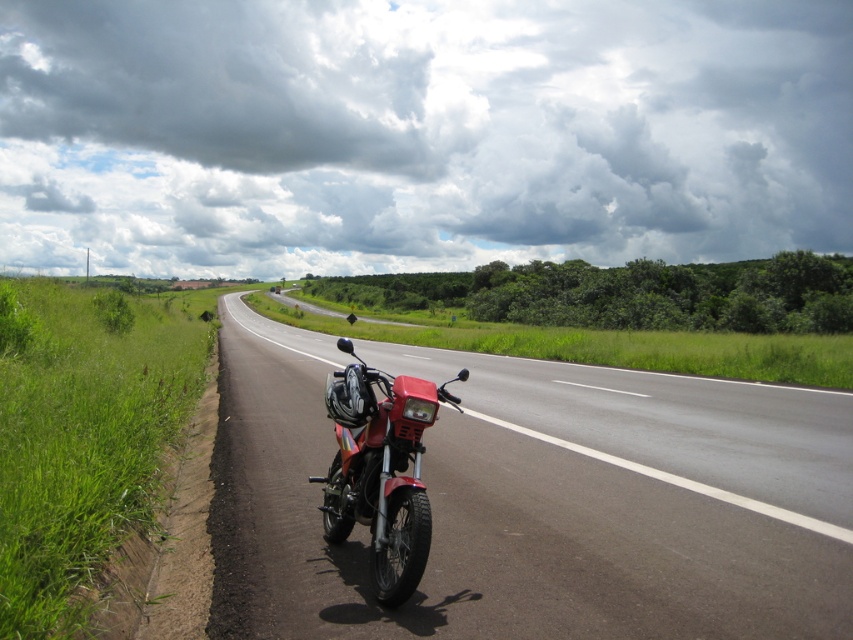
Does smooth asphalt highway at center appear over green grass at left?

Incorrect, smooth asphalt highway at center is not positioned above green grass at left.

Is point (570, 397) in front of point (32, 636)?

No, it is not.

This screenshot has height=640, width=853. Identify the location of smooth asphalt highway at center. (538, 500).

Who is taller, smooth asphalt highway at center or metallic red motorcycle at center?

metallic red motorcycle at center is taller.

The width and height of the screenshot is (853, 640). What do you see at coordinates (538, 500) in the screenshot?
I see `smooth asphalt highway at center` at bounding box center [538, 500].

Measure the distance between point (544, 557) and camera.

Point (544, 557) and camera are 5.08 meters apart.

Find the location of a particular element. The height and width of the screenshot is (640, 853). smooth asphalt highway at center is located at coordinates (538, 500).

Who is shorter, green grass at left or metallic red motorcycle at center?

Standing shorter between the two is metallic red motorcycle at center.

Between green grass at left and metallic red motorcycle at center, which one is positioned higher?

Positioned higher is green grass at left.

Is point (132, 428) in front of point (387, 552)?

No, it is not.

Find the location of a particular element. Image resolution: width=853 pixels, height=640 pixels. green grass at left is located at coordinates (x=82, y=440).